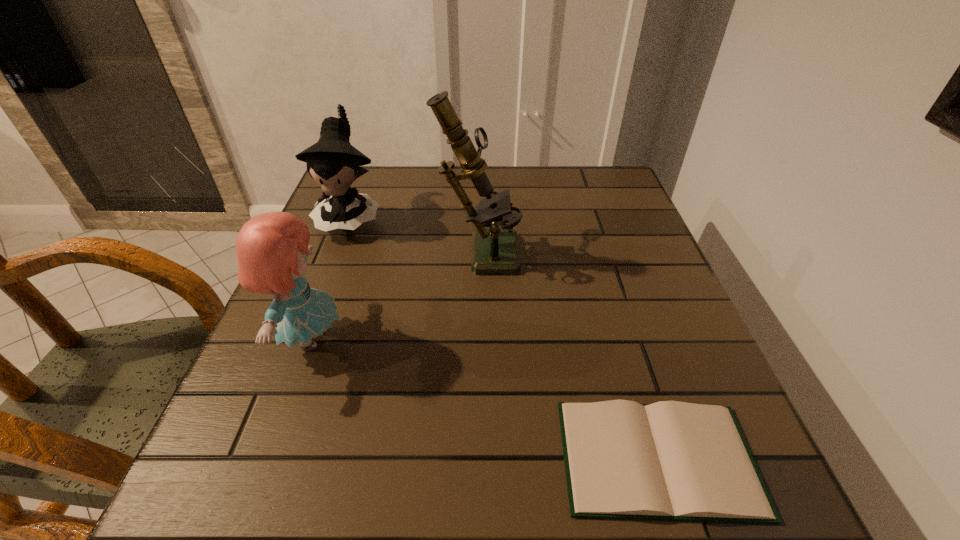
The height and width of the screenshot is (540, 960). In order to click on the third object from left to right in this screenshot , I will do `click(494, 250)`.

I want to click on microscope, so click(x=494, y=250).

The height and width of the screenshot is (540, 960). What are the coordinates of `the third farthest object` in the screenshot? It's located at (272, 248).

Where is `the farther doll`? This screenshot has width=960, height=540. the farther doll is located at coordinates (333, 162).

Find the location of `the rightmost object`. the rightmost object is located at coordinates (676, 461).

Find the location of a particular element. The width and height of the screenshot is (960, 540). hardback book is located at coordinates (676, 461).

Identify the location of blank space located at the eyepiece of the tallest object. The width and height of the screenshot is (960, 540). (595, 249).

Locate an element on the screen. The height and width of the screenshot is (540, 960). vacant space located on the front-facing side of the nearer doll is located at coordinates (394, 339).

The height and width of the screenshot is (540, 960). In order to click on vacant space located at the face of the farther doll in this screenshot , I will do `click(315, 309)`.

Identify the location of vacant space located on the left of the nearest object. (368, 458).